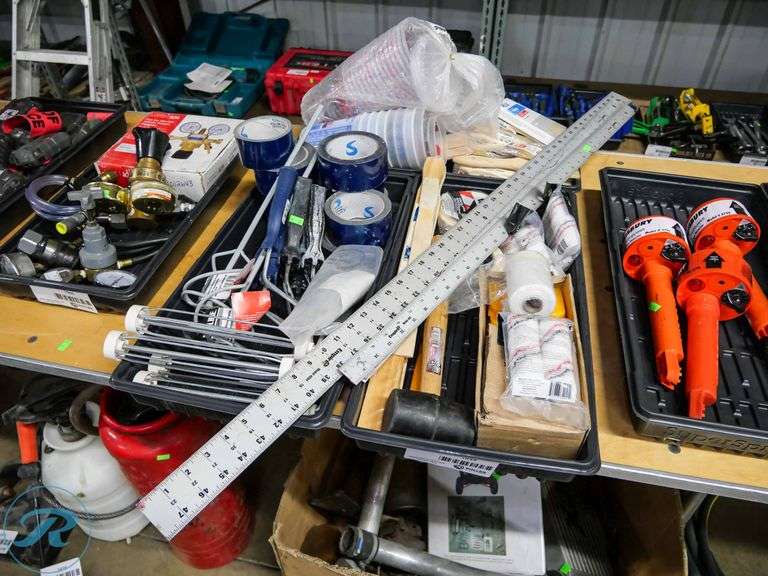
Where is `wall`? This screenshot has width=768, height=576. wall is located at coordinates (563, 45).